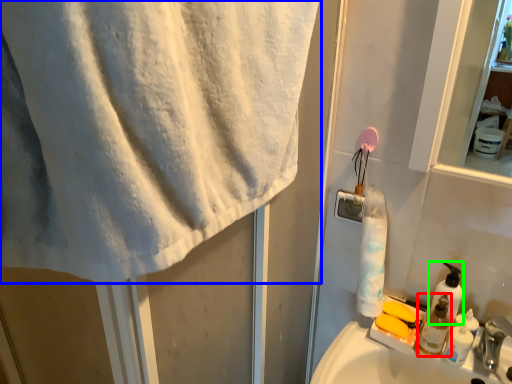
Question: Which object is the closest to the toiletry (highlighted by a red box)? Choose among these: towel (highlighted by a blue box) or soap dispenser (highlighted by a green box).

Choices:
 (A) towel
 (B) soap dispenser

Answer: (B)